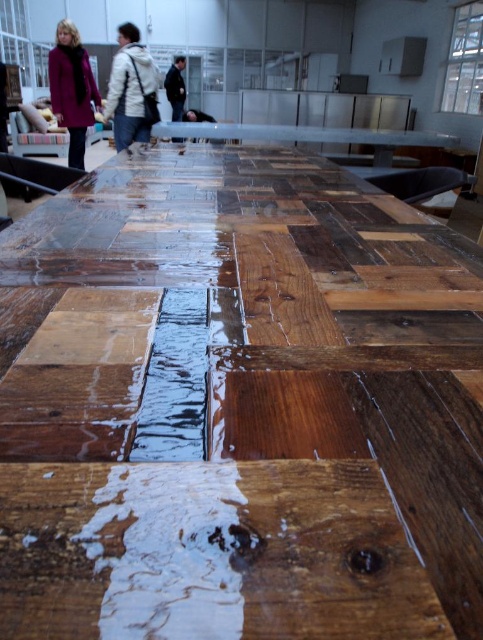
Question: Does matte purple coat at left appear over dark brown leather jacket at center?

Choices:
 (A) no
 (B) yes

Answer: (A)

Question: Is wet wood plank at center closer to camera compared to wooden table at center?

Choices:
 (A) yes
 (B) no

Answer: (A)

Question: Which point appears closest to the camera in this image?

Choices:
 (A) (170, 97)
 (B) (123, 125)
 (C) (318, 132)
 (D) (83, 76)

Answer: (B)

Question: Does dark blue jacket at center have a greater width compared to dark brown leather jacket at center?

Choices:
 (A) no
 (B) yes

Answer: (B)

Question: Among these points, which one is farthest from the camera?

Choices:
 (A) (198, 122)
 (B) (140, 72)

Answer: (A)

Question: Which of the following is the closest to the observer?

Choices:
 (A) white matte jacket at upper left
 (B) wet wood plank at center
 (C) dark brown leather jacket at center
 (D) matte purple coat at left

Answer: (B)